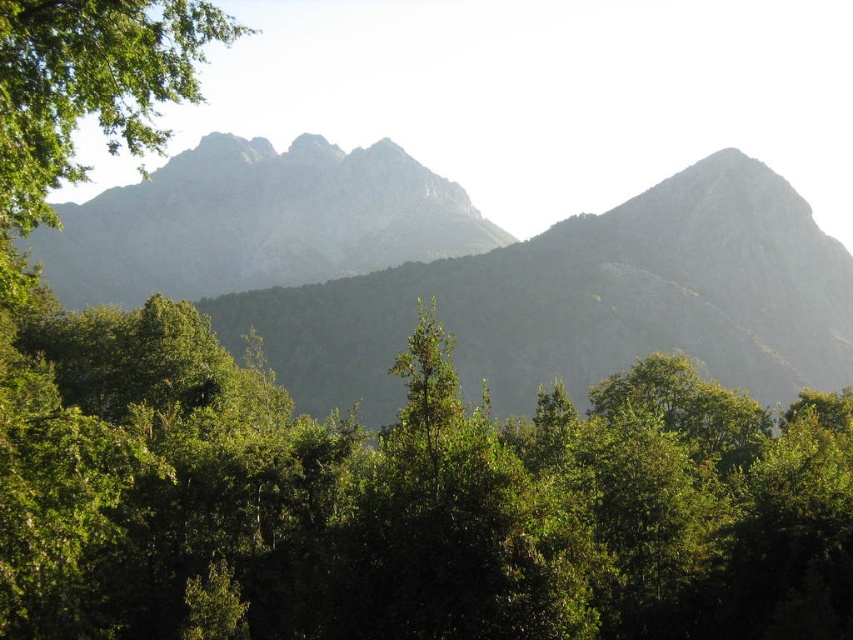
Question: Which is farther from the green leafy tree at center?

Choices:
 (A) gray rocky mountain range at upper center
 (B) green leafy tree at upper left
 (C) gray rocky mountain at center

Answer: (C)

Question: Does gray rocky mountain at center lie in front of green leafy tree at upper left?

Choices:
 (A) yes
 (B) no

Answer: (B)

Question: Does gray rocky mountain at center appear over green leafy tree at upper left?

Choices:
 (A) no
 (B) yes

Answer: (A)

Question: Which point is closer to the camera taking this photo?

Choices:
 (A) (209, 220)
 (B) (4, 112)
 (C) (451, 205)

Answer: (B)

Question: Based on their relative distances, which object is farther from the green leafy tree at upper left?

Choices:
 (A) gray rocky mountain range at upper center
 (B) green leafy tree at center

Answer: (A)

Question: Is the position of green leafy tree at center more distant than that of gray rocky mountain range at upper center?

Choices:
 (A) yes
 (B) no

Answer: (B)